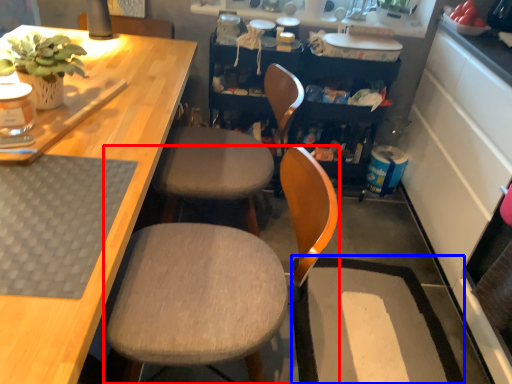
Question: Which object is further to the camera taking this photo, chair (highlighted by a red box) or wide (highlighted by a blue box)?

Choices:
 (A) chair
 (B) wide

Answer: (B)